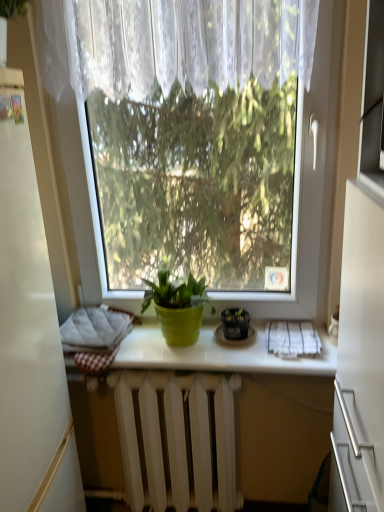
Question: In the image, is white painted metal radiator at center positioned in front of or behind green matte pot at center, which is counted as the second houseplant, starting from the right?

Choices:
 (A) front
 (B) behind

Answer: (B)

Question: Considering the relative positions of white painted metal radiator at center and green matte pot at center, which is the 1th houseplant from left to right, in the image provided, is white painted metal radiator at center to the left or to the right of green matte pot at center, which is the 1th houseplant from left to right,?

Choices:
 (A) left
 (B) right

Answer: (B)

Question: Considering the real-world distances, which object is closest to the white painted metal radiator at center?

Choices:
 (A) matte black pot at center, acting as the 2th houseplant starting from the left
 (B) green matte pot at center
 (C) white textured cloth at lower right
 (D) green matte pot at center, which is the 1th houseplant from left to right
 (E) white lace curtain at upper center

Answer: (B)

Question: Which object is positioned closest to the white painted metal radiator at center?

Choices:
 (A) white textured cloth at lower right
 (B) green matte pot at center, which is counted as the second houseplant, starting from the right
 (C) matte black pot at center, acting as the 2th houseplant starting from the left
 (D) green matte pot at center
 (E) transparent glass window at center

Answer: (D)